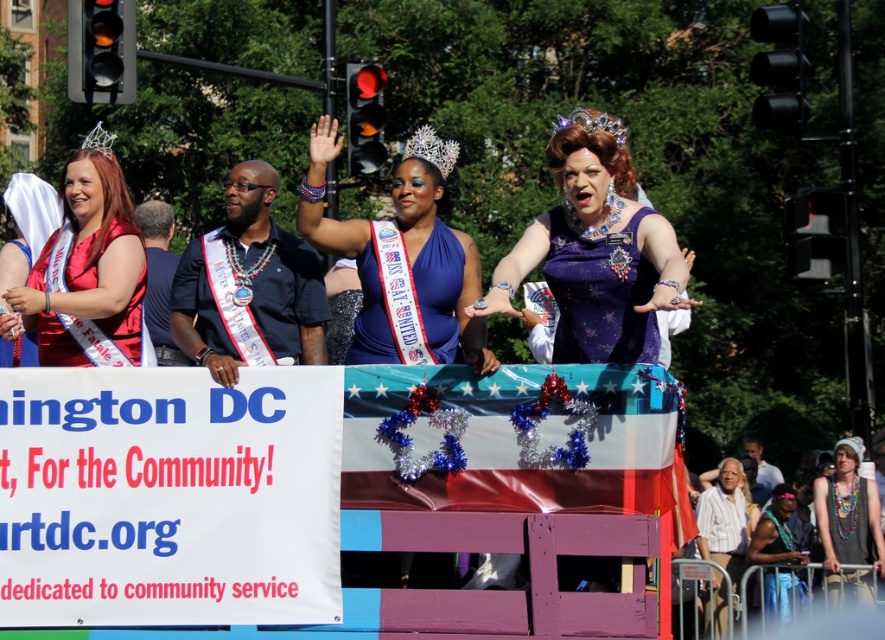
From the picture: You are a photographer standing at the edge of the parade route. You want to take a photo that includes both the shiny blue dress at center and the beige fabric tank top at lower right. Given that your camera has a maximum focus range of 20 meters, will you be able to capture both in the same frame without moving?

The shiny blue dress at center and beige fabric tank top at lower right are 23.73 meters apart, which exceeds the camera maximum focus range of 20 meters. Therefore, you will not be able to capture both in the same frame without moving.